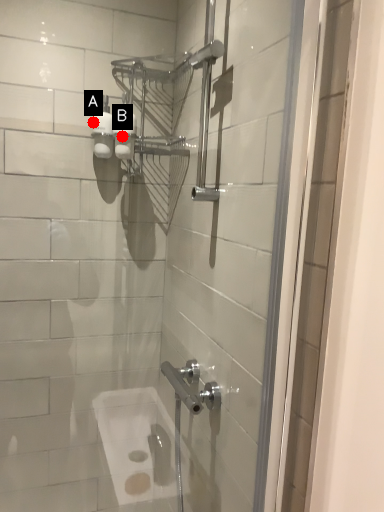
Question: Two points are circled on the image, labeled by A and B beside each circle. Which point is closer to the camera?

Choices:
 (A) A is closer
 (B) B is closer

Answer: (A)